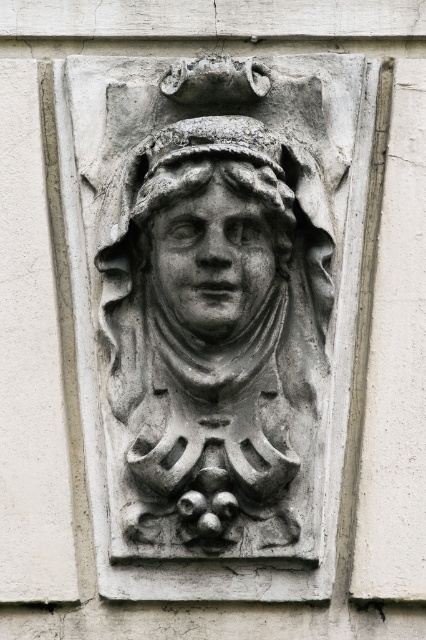
Who is more forward, (x=275, y=177) or (x=215, y=320)?

Positioned in front is point (x=215, y=320).

Is gray stone carving at center above gray stone face at center?

Incorrect, gray stone carving at center is not positioned above gray stone face at center.

Is point (221, 365) farther from viewer compared to point (169, 276)?

Yes, point (221, 365) is behind point (169, 276).

Where is `gray stone carving at center`? gray stone carving at center is located at coordinates (215, 336).